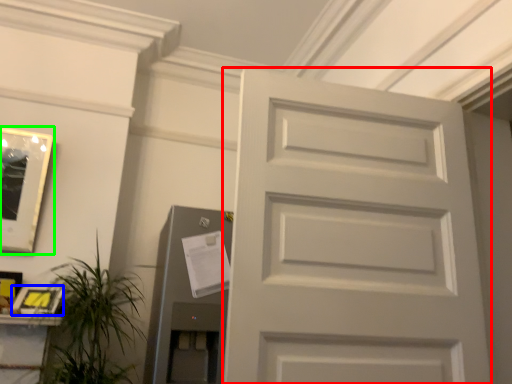
Question: Estimate the real-world distances between objects in this image. Which object is farther from door (highlighted by a red box), picture frame (highlighted by a blue box) or picture frame (highlighted by a green box)?

Choices:
 (A) picture frame
 (B) picture frame

Answer: (B)